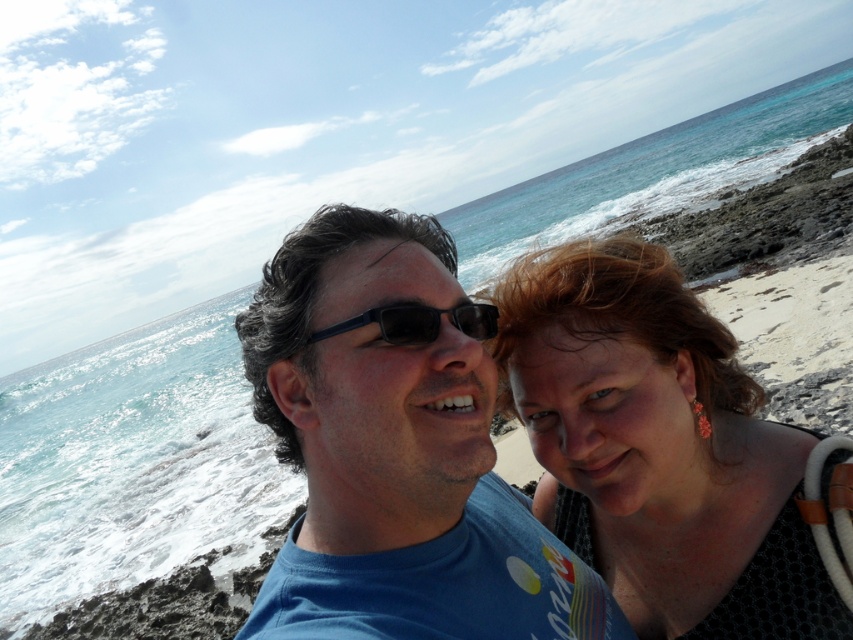
Question: Estimate the real-world distances between objects in this image. Which object is farther from the black plastic sunglasses at center?

Choices:
 (A) matte black hair at center
 (B) blue matte shirt at center

Answer: (A)

Question: Is blue matte shirt at center positioned at the back of matte black hair at center?

Choices:
 (A) no
 (B) yes

Answer: (A)

Question: Does blue matte shirt at center have a greater width compared to black plastic sunglasses at center?

Choices:
 (A) yes
 (B) no

Answer: (A)

Question: Among these points, which one is farthest from the camera?

Choices:
 (A) (469, 330)
 (B) (815, 561)
 (C) (277, 445)

Answer: (C)

Question: Based on their relative distances, which object is farther from the matte black hair at center?

Choices:
 (A) black plastic sunglasses at center
 (B) blue matte shirt at center

Answer: (A)

Question: Is blue matte shirt at center below black plastic sunglasses at center?

Choices:
 (A) yes
 (B) no

Answer: (A)